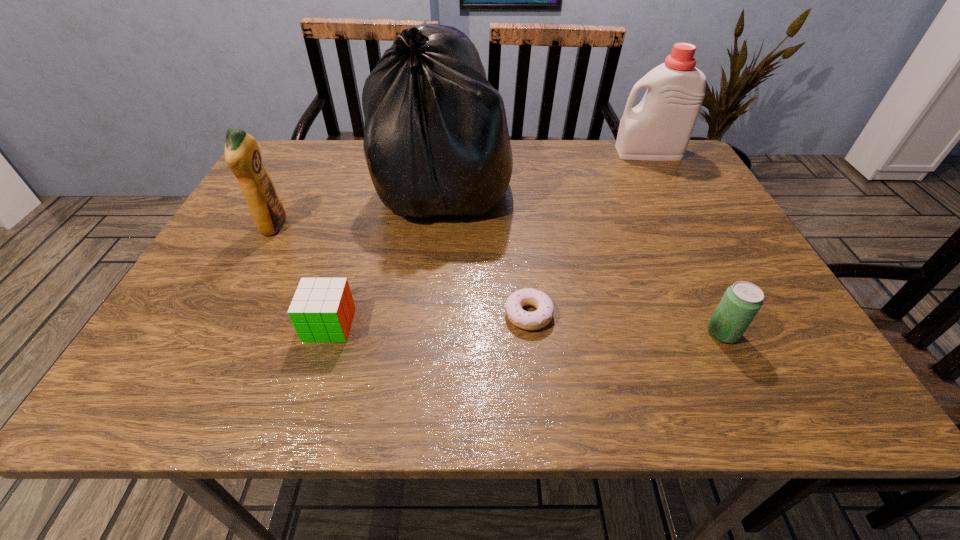
I want to click on vacant point that satisfies the following two spatial constraints: 1. on the label of the shorter detergent; 2. on the back side of the soda, so click(x=217, y=333).

I want to click on free space that satisfies the following two spatial constraints: 1. on the handle side of the farther detergent; 2. on the front side of the tallest object, so click(665, 184).

The image size is (960, 540). I want to click on blank space that satisfies the following two spatial constraints: 1. on the front side of the shortest object; 2. on the left side of the fourth tallest object, so [530, 333].

The image size is (960, 540). What are the coordinates of `vacant space that satisfies the following two spatial constraints: 1. on the label of the shorter detergent; 2. on the back side of the fourth tallest object` in the screenshot? It's located at (217, 333).

Locate an element on the screen. The height and width of the screenshot is (540, 960). free space that satisfies the following two spatial constraints: 1. on the label of the shorter detergent; 2. on the left side of the soda is located at coordinates (217, 333).

You are a GUI agent. You are given a task and a screenshot of the screen. Output one action in this format:
    pyautogui.click(x=<x>, y=<y>)
    Task: Click on the vacant region that satisfies the following two spatial constraints: 1. on the label of the leftmost object; 2. on the back side of the second shortest object
    
    Given the screenshot: What is the action you would take?
    pyautogui.click(x=221, y=325)

Image resolution: width=960 pixels, height=540 pixels. I want to click on vacant space that satisfies the following two spatial constraints: 1. on the label of the doughnut; 2. on the left side of the third tallest object, so click(x=227, y=315).